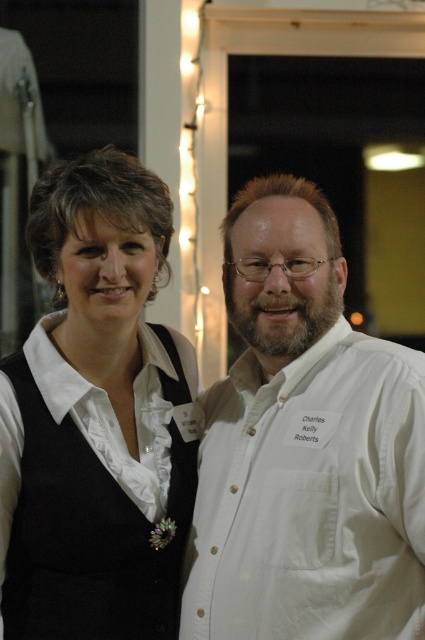
Question: Which point is farther to the camera?

Choices:
 (A) white matte vest at center
 (B) white cotton shirt at center

Answer: (A)

Question: Which point appears closest to the camera in this image?

Choices:
 (A) (34, 369)
 (B) (258, 484)

Answer: (B)

Question: Observing the image, what is the correct spatial positioning of white cotton shirt at center in reference to white matte vest at center?

Choices:
 (A) above
 (B) below

Answer: (B)

Question: Does white cotton shirt at center appear over white matte vest at center?

Choices:
 (A) no
 (B) yes

Answer: (A)

Question: Is white cotton shirt at center above white matte vest at center?

Choices:
 (A) no
 (B) yes

Answer: (A)